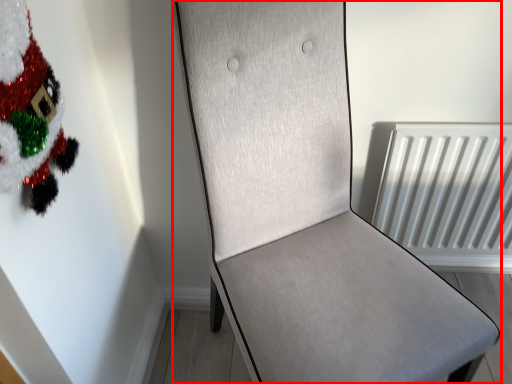
Question: From the image's perspective, what is the correct spatial positioning of furniture (annotated by the red box) in reference to christmas tree?

Choices:
 (A) below
 (B) above

Answer: (A)